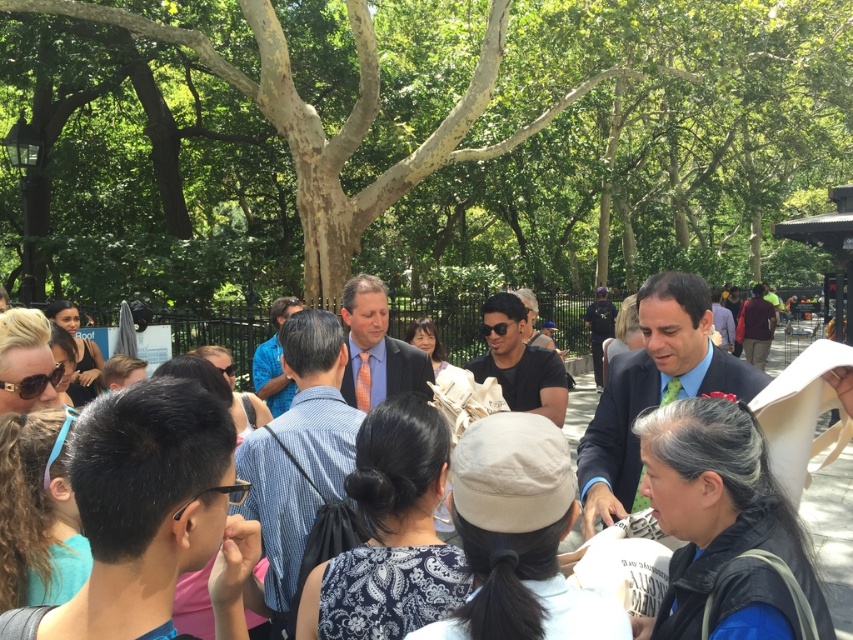
In the scene shown: You are standing at the center of the park and see the point marked at coordinates (376, 348). What object is located at that point?

The point at (376, 348) indicates a matte blue suit at center.